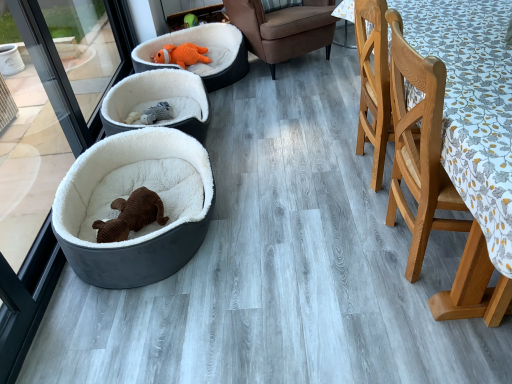
Question: Is white plush dog bed at center, the 2th dog bed when ordered from back to front, aimed at light brown wooden chair at right, which is the first chair in front-to-back order?

Choices:
 (A) no
 (B) yes

Answer: (A)

Question: Would you consider white plush dog bed at center, the 2th dog bed viewed from the front, to be distant from light brown wooden chair at right, the 1th chair when ordered from bottom to top?

Choices:
 (A) yes
 (B) no

Answer: (A)

Question: Is light brown wooden chair at right, the second chair viewed from the back, a part of white plush dog bed at center, the 2th dog bed when ordered from back to front?

Choices:
 (A) yes
 (B) no

Answer: (B)

Question: Is white plush dog bed at center, the 2th dog bed viewed from the front, turned away from light brown wooden chair at right, which is the first chair in front-to-back order?

Choices:
 (A) yes
 (B) no

Answer: (B)

Question: Does white plush dog bed at center, the 2th dog bed viewed from the front, come behind light brown wooden chair at right, the 1th chair when ordered from bottom to top?

Choices:
 (A) yes
 (B) no

Answer: (A)

Question: Is light brown wooden chair at right, the 2th chair in the top-to-bottom sequence, taller or shorter than white plush dog bed at center, the 2th dog bed viewed from the front?

Choices:
 (A) short
 (B) tall

Answer: (B)

Question: Is light brown wooden chair at right, the 1th chair when ordered from bottom to top, spatially inside white plush dog bed at center, the 2th dog bed when ordered from back to front, or outside of it?

Choices:
 (A) inside
 (B) outside

Answer: (B)

Question: In the image, is light brown wooden chair at right, the second chair viewed from the back, on the left side or the right side of white plush dog bed at center, the 2th dog bed when ordered from back to front?

Choices:
 (A) left
 (B) right

Answer: (B)

Question: From the image's perspective, relative to white plush dog bed at center, the 2th dog bed viewed from the front, is light brown wooden chair at right, the 2th chair in the top-to-bottom sequence, above or below?

Choices:
 (A) above
 (B) below

Answer: (B)

Question: Is orange plush dog bed at upper center, arranged as the 1th dog bed when viewed from the back, situated inside velvet brown dog bed at left, acting as the 3th dog bed starting from the back, or outside?

Choices:
 (A) outside
 (B) inside

Answer: (A)

Question: In terms of size, does orange plush dog bed at upper center, which appears as the 3th dog bed when viewed from the front, appear bigger or smaller than velvet brown dog bed at left, which is counted as the first dog bed, starting from the front?

Choices:
 (A) big
 (B) small

Answer: (A)

Question: Based on their positions, is orange plush dog bed at upper center, arranged as the 1th dog bed when viewed from the back, located to the left or right of velvet brown dog bed at left, which is counted as the first dog bed, starting from the front?

Choices:
 (A) right
 (B) left

Answer: (A)

Question: Does point (140, 57) appear closer or farther from the camera than point (86, 249)?

Choices:
 (A) farther
 (B) closer

Answer: (A)

Question: Considering the relative positions of velvet brown dog bed at left, which is counted as the first dog bed, starting from the front, and white plush dog bed at center, the 2th dog bed viewed from the front, in the image provided, is velvet brown dog bed at left, which is counted as the first dog bed, starting from the front, to the left or to the right of white plush dog bed at center, the 2th dog bed viewed from the front,?

Choices:
 (A) right
 (B) left

Answer: (A)

Question: Which is correct: velvet brown dog bed at left, acting as the 3th dog bed starting from the back, is inside white plush dog bed at center, the 2th dog bed viewed from the front, or outside of it?

Choices:
 (A) outside
 (B) inside

Answer: (A)